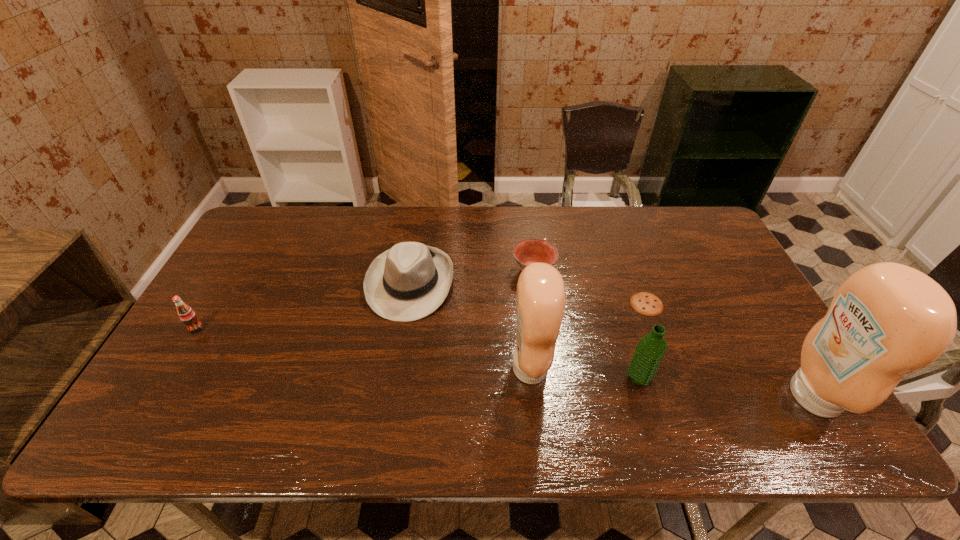
You are a GUI agent. You are given a task and a screenshot of the screen. Output one action in this format:
    pyautogui.click(x=<x>, y=<y>)
    Task: Click on the vacant space at the far right corner
    
    Given the screenshot: What is the action you would take?
    pyautogui.click(x=655, y=207)

Identify the location of vacant region between the bowl and the taller condiment. The width and height of the screenshot is (960, 540). (674, 333).

The width and height of the screenshot is (960, 540). In order to click on free space between the second object from left to right and the bowl in this screenshot , I will do `click(471, 276)`.

The image size is (960, 540). I want to click on free space between the fifth shortest object and the rightmost object, so click(x=726, y=387).

Where is `vacant region between the bowl and the shortest object`? Image resolution: width=960 pixels, height=540 pixels. vacant region between the bowl and the shortest object is located at coordinates (590, 287).

The width and height of the screenshot is (960, 540). Identify the location of vacant area between the second object from left to right and the taller condiment. (612, 339).

I want to click on vacant area that lies between the second shortest object and the rightmost object, so click(x=674, y=333).

This screenshot has width=960, height=540. In order to click on free space between the sixth object from left to right and the second tallest object in this screenshot , I will do `click(588, 336)`.

Locate an element on the screen. The width and height of the screenshot is (960, 540). object identified as the fourth closest to the fourth nearest object is located at coordinates (650, 350).

Locate which object is the third closest to the water bottle. Please provide its 2D coordinates. Your answer should be formatted as a tuple, i.e. [(x, y)], where the tuple contains the x and y coordinates of a point satisfying the conditions above.

[(886, 320)]